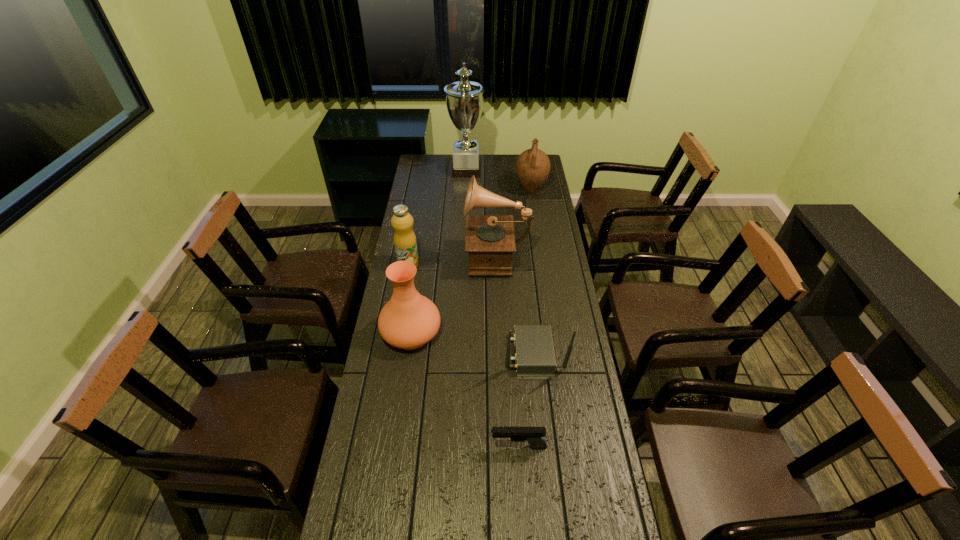
Locate an element on the screen. Image resolution: width=960 pixels, height=540 pixels. vacant space located on the front-facing side of the shortest object is located at coordinates (417, 447).

This screenshot has width=960, height=540. I want to click on object that is at the far edge, so click(464, 99).

I want to click on vase positioned at the left edge, so click(409, 320).

You are a GUI agent. You are given a task and a screenshot of the screen. Output one action in this format:
    pyautogui.click(x=<x>, y=<y>)
    Task: Click on the fruit juice present at the left edge
    This screenshot has width=960, height=540.
    Given the screenshot: What is the action you would take?
    pyautogui.click(x=405, y=243)

Identify the location of record player that is at the right edge. Image resolution: width=960 pixels, height=540 pixels. point(490,240).

I want to click on pitcher that is at the right edge, so click(x=533, y=166).

The height and width of the screenshot is (540, 960). I want to click on router at the right edge, so click(x=534, y=357).

The height and width of the screenshot is (540, 960). In the image, there is a desktop. Identify the location of free space at the far edge. (446, 176).

This screenshot has width=960, height=540. In order to click on free spot at the left edge of the desktop in this screenshot , I will do `click(396, 363)`.

This screenshot has height=540, width=960. In order to click on free space at the right edge of the desktop in this screenshot , I will do `click(555, 218)`.